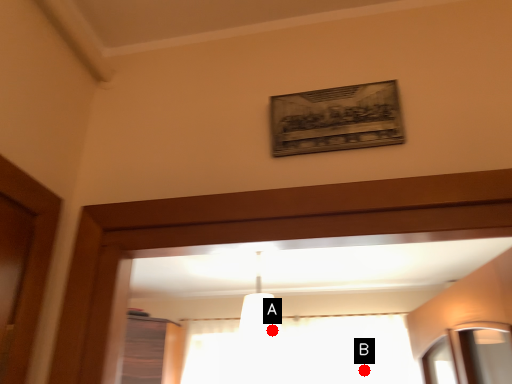
Question: Two points are circled on the image, labeled by A and B beside each circle. Which point is further to the camera?

Choices:
 (A) A is further
 (B) B is further

Answer: (B)